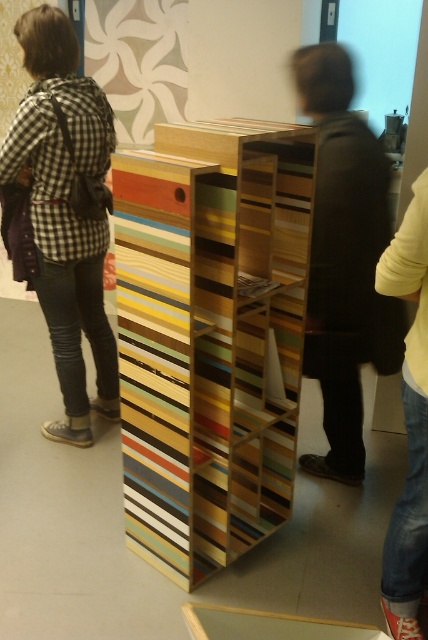
Question: Among these objects, which one is nearest to the camera?

Choices:
 (A) wooden striped bookshelf at center
 (B) dark brown leather jacket at center

Answer: (A)

Question: Which is farther from the checkered fabric shirt at left?

Choices:
 (A) dark brown leather jacket at center
 (B) wooden striped bookshelf at center

Answer: (A)

Question: Does wooden striped bookshelf at center lie behind checkered fabric shirt at left?

Choices:
 (A) yes
 (B) no

Answer: (B)

Question: Is wooden striped bookshelf at center further to camera compared to checkered fabric shirt at left?

Choices:
 (A) yes
 (B) no

Answer: (B)

Question: Does checkered fabric shirt at left lie in front of dark brown leather jacket at center?

Choices:
 (A) yes
 (B) no

Answer: (B)

Question: Among these points, which one is nearest to the camera?

Choices:
 (A) (410, 349)
 (B) (97, 248)
 (C) (213, 129)

Answer: (A)